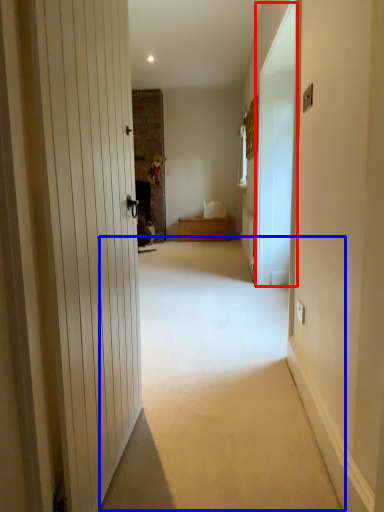
Question: Which object appears farthest to the camera in this image, screen door (highlighted by a red box) or corridor (highlighted by a blue box)?

Choices:
 (A) screen door
 (B) corridor

Answer: (A)